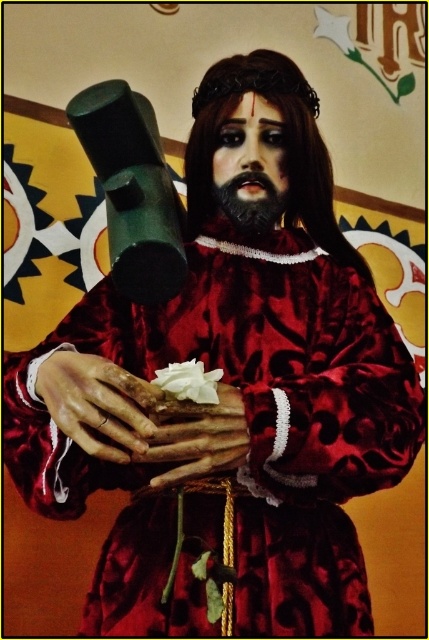
Measure the distance between point (217, 468) and camera.

A distance of 3.64 feet exists between point (217, 468) and camera.

Does smooth leather gloves at center have a greater width compared to black matte beard at center?

Indeed, smooth leather gloves at center has a greater width compared to black matte beard at center.

Which is in front, point (166, 428) or point (271, 186)?

Point (166, 428)

The image size is (429, 640). I want to click on smooth leather gloves at center, so click(196, 436).

Can you confirm if leather-like hand at center is wider than black matte beard at center?

Correct, the width of leather-like hand at center exceeds that of black matte beard at center.

Can you confirm if leather-like hand at center is positioned to the left of black matte beard at center?

Indeed, leather-like hand at center is positioned on the left side of black matte beard at center.

What are the coordinates of `leather-like hand at center` in the screenshot? It's located at (97, 404).

Is leather-like hand at center bigger than smooth leather gloves at center?

Indeed, leather-like hand at center has a larger size compared to smooth leather gloves at center.

Between leather-like hand at center and smooth leather gloves at center, which one appears on the right side from the viewer's perspective?

Positioned to the right is smooth leather gloves at center.

The image size is (429, 640). I want to click on leather-like hand at center, so click(97, 404).